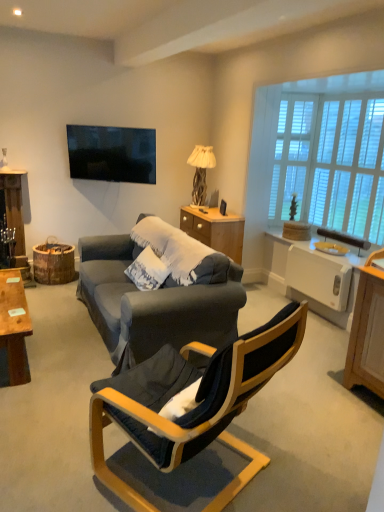
Measure the distance between white matte window screen at upper right and camera.

white matte window screen at upper right and camera are 4.41 meters apart.

The width and height of the screenshot is (384, 512). Describe the element at coordinates (292, 155) in the screenshot. I see `white matte window screen at upper right` at that location.

The height and width of the screenshot is (512, 384). Identify the location of wooden desk at left. (14, 327).

Considering the sizes of wooden desk at left and velvet dark blue chair at center in the image, is wooden desk at left bigger or smaller than velvet dark blue chair at center?

Clearly, wooden desk at left is smaller in size than velvet dark blue chair at center.

In the image, is wooden desk at left on the left side or the right side of velvet dark blue chair at center?

Clearly, wooden desk at left is on the left of velvet dark blue chair at center in the image.

Based on the photo, is wooden desk at left oriented away from velvet dark blue chair at center?

That's not correct — wooden desk at left is not looking away from velvet dark blue chair at center.

Is wooden desk at left not within velvet dark blue chair at center?

That's correct, wooden desk at left is outside of velvet dark blue chair at center.

Considering the sizes of white wooden window at upper right, which is the 1th window in left-to-right order, and white matte window screen at upper right in the image, is white wooden window at upper right, which is the 1th window in left-to-right order, wider or thinner than white matte window screen at upper right?

white wooden window at upper right, which is the 1th window in left-to-right order, is thinner than white matte window screen at upper right.

From a real-world perspective, is white wooden window at upper right, the 2th window in the right-to-left sequence, positioned above or below white matte window screen at upper right?

white wooden window at upper right, the 2th window in the right-to-left sequence, is below white matte window screen at upper right.

Between white wooden window at upper right, which is the 1th window in left-to-right order, and white matte window screen at upper right, which one has less height?

white matte window screen at upper right.

Considering their positions, is velvet dark blue chair at center located in front of or behind white textured pillow at center?

velvet dark blue chair at center is positioned closer to the viewer than white textured pillow at center.

Is velvet dark blue chair at center oriented away from white textured pillow at center?

No, velvet dark blue chair at center is not facing away from white textured pillow at center.

Which object is thinner, velvet dark blue chair at center or white textured pillow at center?

white textured pillow at center is thinner.

From a real-world perspective, who is located higher, wooden textured lamp at center or white wooden blinds at right, the first window when ordered from right to left?

white wooden blinds at right, the first window when ordered from right to left, from a real-world perspective.

Based on the photo, which is correct: wooden textured lamp at center is inside white wooden blinds at right, which is the second window from left to right, or outside of it?

wooden textured lamp at center exists outside the volume of white wooden blinds at right, which is the second window from left to right.

Is wooden textured lamp at center next to white wooden blinds at right, the first window when ordered from right to left, and touching it?

No, wooden textured lamp at center is not in contact with white wooden blinds at right, the first window when ordered from right to left.

Between wooden textured lamp at center and white wooden blinds at right, the first window when ordered from right to left, which one appears on the left side from the viewer's perspective?

wooden textured lamp at center is more to the left.

Is woodenmaterial/texturedresser at center further to camera compared to velvet dark blue chair at center?

Yes, it is behind velvet dark blue chair at center.

Which object is positioned more to the left, woodenmaterial/texturedresser at center or velvet dark blue chair at center?

Positioned to the left is velvet dark blue chair at center.

Is velvet dark blue chair at center at the back of woodenmaterial/texturedresser at center?

No, woodenmaterial/texturedresser at center is not facing away from velvet dark blue chair at center.

From a real-world perspective, is woodenmaterial/texturedresser at center located higher than velvet dark blue chair at center?

No, from a real-world perspective, woodenmaterial/texturedresser at center is not over velvet dark blue chair at center

From a real-world perspective, is white matte window screen at upper right positioned above or below wooden textured lamp at center?

white matte window screen at upper right is above wooden textured lamp at center.

Can you confirm if white matte window screen at upper right is wider than wooden textured lamp at center?

No.

Could you tell me if white matte window screen at upper right is turned towards wooden textured lamp at center?

No, white matte window screen at upper right is not aimed at wooden textured lamp at center.

Is white matte window screen at upper right smaller than wooden textured lamp at center?

Yes, white matte window screen at upper right is smaller than wooden textured lamp at center.

From a real-world perspective, which is physically above, yellow plastic loudspeaker at upper right or white wooden blinds at right, which is the second window from left to right?

From a 3D spatial view, white wooden blinds at right, which is the second window from left to right, is above.

Is yellow plastic loudspeaker at upper right turned away from white wooden blinds at right, which is the second window from left to right?

Correct, yellow plastic loudspeaker at upper right is looking away from white wooden blinds at right, which is the second window from left to right.

Between point (359, 252) and point (342, 193), which one is positioned in front?

The point (359, 252) is closer to the camera.

Image resolution: width=384 pixels, height=512 pixels. I want to click on chair that appears in front of the wooden desk at left, so click(195, 407).

I want to click on window screen that appears above the white wooden window at upper right, which is the 1th window in left-to-right order (from a real-world perspective), so click(x=292, y=155).

When comparing their distances from woodenmaterial/texturedresser at center, does white plastic toaster at right or white textured pillow at center seem closer?

white plastic toaster at right lies closer to woodenmaterial/texturedresser at center than the other object.

Considering their positions, is white wooden blinds at right, the first window when ordered from right to left, positioned closer to yellow plastic loudspeaker at upper right than white textured pillow at center?

white wooden blinds at right, the first window when ordered from right to left, is positioned closer to the anchor yellow plastic loudspeaker at upper right.

When comparing their distances from white wooden blinds at right, the first window when ordered from right to left, does wooden desk at left or woodenmaterial/texturedresser at center seem closer?

The object closer to white wooden blinds at right, the first window when ordered from right to left, is woodenmaterial/texturedresser at center.

Based on the photo, when comparing their distances from white wooden blinds at right, the first window when ordered from right to left, does white textured pillow at center or wooden desk at left seem further?

wooden desk at left lies further to white wooden blinds at right, the first window when ordered from right to left, than the other object.

When comparing their distances from wooden textured lamp at center, does velvet dark blue chair at center or white wooden window at upper right, which is the 1th window in left-to-right order, seem closer?

white wooden window at upper right, which is the 1th window in left-to-right order, is positioned closer to the anchor wooden textured lamp at center.

In the scene shown: Looking at the image, which one is located closer to velvet dark blue chair at center, woodenmaterial/texturedresser at center or white wooden window at upper right, which is the 1th window in left-to-right order?

woodenmaterial/texturedresser at center is closer to velvet dark blue chair at center.

From the picture: Which object lies nearer to the anchor point white wooden window at upper right, the 2th window in the right-to-left sequence, wooden textured lamp at center or wooden desk at left?

Based on the image, wooden textured lamp at center appears to be nearer to white wooden window at upper right, the 2th window in the right-to-left sequence.

Looking at the image, which one is located closer to white textured pillow at center, white wooden window at upper right, the 2th window in the right-to-left sequence, or white matte window screen at upper right?

Among the two, white matte window screen at upper right is located nearer to white textured pillow at center.

At what (x,y) coordinates should I click in order to perform the action: click on dresser between white matte window screen at upper right and white plastic toaster at right vertically. Please return your answer as a coordinate pair (x, y). This screenshot has height=512, width=384. Looking at the image, I should click on (215, 230).

I want to click on pillow between velvet dark blue chair at center and woodenmaterial/texturedresser at center from front to back, so click(x=147, y=270).

Locate an element on the screen. This screenshot has height=512, width=384. dresser between wooden desk at left and white wooden window at upper right, which is the 1th window in left-to-right order, from left to right is located at coordinates (215, 230).

At what (x,y) coordinates should I click in order to perform the action: click on lamp situated between wooden desk at left and white plastic toaster at right from left to right. Please return your answer as a coordinate pair (x, y). The width and height of the screenshot is (384, 512). Looking at the image, I should click on (201, 170).